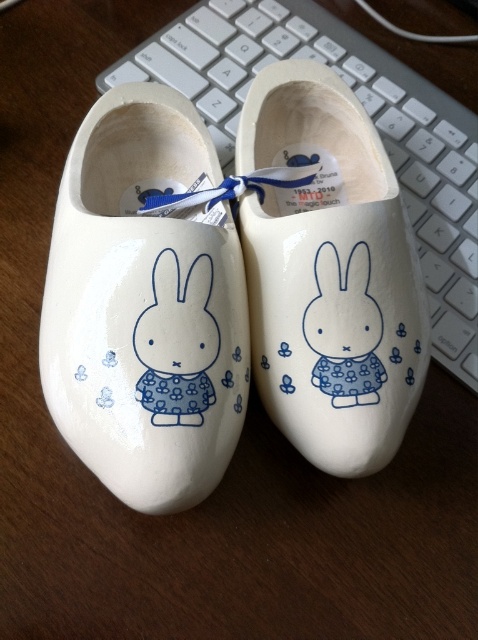
Question: Observing the image, what is the correct spatial positioning of white glossy wooden shoe at left in reference to white plastic keyboard at upper center?

Choices:
 (A) left
 (B) right

Answer: (A)

Question: Is the position of white glossy wooden shoe at left more distant than that of white glossy wooden clog at center?

Choices:
 (A) yes
 (B) no

Answer: (B)

Question: Which object appears closest to the camera in this image?

Choices:
 (A) white glossy wooden clog at center
 (B) white glossy wooden shoe at left

Answer: (B)

Question: Considering the relative positions of white glossy wooden shoe at left and white glossy wooden clog at center in the image provided, where is white glossy wooden shoe at left located with respect to white glossy wooden clog at center?

Choices:
 (A) above
 (B) below

Answer: (B)

Question: Which of the following is the closest to the observer?

Choices:
 (A) white glossy wooden clog at center
 (B) white glossy wooden shoe at left
 (C) white plastic keyboard at upper center

Answer: (B)

Question: Among these points, which one is farthest from the camera?

Choices:
 (A) (397, 419)
 (B) (463, 316)
 (C) (118, 104)

Answer: (B)